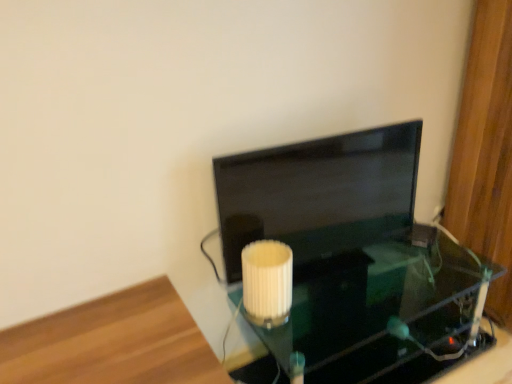
The height and width of the screenshot is (384, 512). Find the location of `vacant space in matte black monitor at center (from a real-world perspective)`. vacant space in matte black monitor at center (from a real-world perspective) is located at coordinates (337, 264).